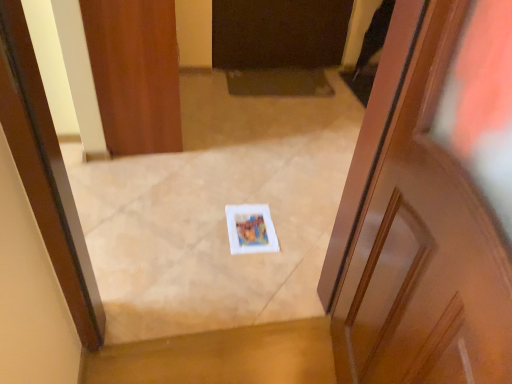
Question: In terms of width, does wooden door at upper left, which is the first door from left to right, look wider or thinner when compared to wooden door at center, the second door from the back?

Choices:
 (A) thin
 (B) wide

Answer: (B)

Question: In terms of height, does wooden door at upper left, marked as the 2th door in a bottom-to-top arrangement, look taller or shorter compared to wooden door at center, the second door from the left?

Choices:
 (A) tall
 (B) short

Answer: (B)

Question: From the image's perspective, is wooden door at upper left, arranged as the 1th door when viewed from the back, located above or below wooden door at center, which is the 1th door from right to left?

Choices:
 (A) above
 (B) below

Answer: (A)

Question: Is wooden door at center, the second door from the left, bigger or smaller than wooden door at upper left, which appears as the 1th door when viewed from the top?

Choices:
 (A) small
 (B) big

Answer: (A)

Question: In the image, is wooden door at center, the 2th door viewed from the top, on the left side or the right side of wooden door at upper left, arranged as the 1th door when viewed from the back?

Choices:
 (A) left
 (B) right

Answer: (B)

Question: Considering their positions, is wooden door at center, the first door viewed from the front, located in front of or behind wooden door at upper left, which is the first door from left to right?

Choices:
 (A) behind
 (B) front

Answer: (B)

Question: Is wooden door at center, which is the 1th door from right to left, situated inside wooden door at upper left, arranged as the 1th door when viewed from the back, or outside?

Choices:
 (A) inside
 (B) outside

Answer: (B)